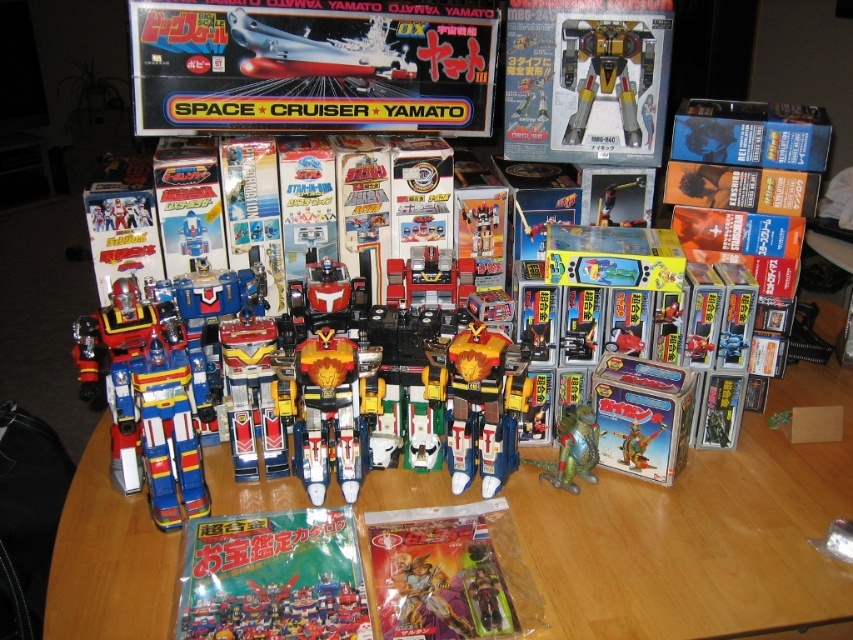
You are a parent trying to decide if your child can easily reach the metallic silver toy at upper center on the wooden table at center. Considering the table height, will the toy be within a child of average height?

The wooden table at center has a greater height compared to metallic silver toy at upper center, so the toy may be difficult for a child of average height to reach comfortably.

You are a toy collector who wants to place a new toy at the exact center of the table. You currently have the matte plastic action figure at center. Where should you place the new toy relative to the existing action figure?

The new toy should be placed at the exact center of the table, which is different from the current position of the matte plastic action figure at center located at point (450, 573). Since the action figure is already at the center, placing the new toy there would mean positioning it at the same coordinates as the existing action figure.

You are a collector who wants to display the matte green plastic comic book at lower center and the shiny plastic robots at center on a shelf. If the shelf has limited space, which item should you prioritize keeping to save space?

The matte green plastic comic book at lower center is smaller than the shiny plastic robots at center, so you should prioritize keeping the matte green plastic comic book at lower center to save space.